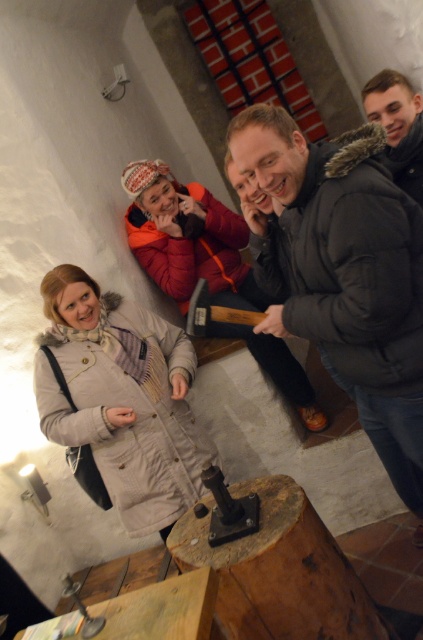
Question: Is the position of black puffy jacket at upper right more distant than that of dark gray fur-lined jacket at upper right?

Choices:
 (A) no
 (B) yes

Answer: (A)

Question: Which point appears farthest from the camera in this image?

Choices:
 (A) (164, 429)
 (B) (211, 333)
 (C) (393, 147)
 (D) (390, 268)

Answer: (B)

Question: Does beige woolen coat at lower left appear on the right side of orange fleece jacket at upper center?

Choices:
 (A) no
 (B) yes

Answer: (A)

Question: Estimate the real-world distances between objects in this image. Which object is farther from the orange fleece jacket at upper center?

Choices:
 (A) black puffy jacket at upper right
 (B) beige woolen coat at lower left

Answer: (A)

Question: Can you confirm if black puffy jacket at upper right is positioned to the right of orange fleece jacket at upper center?

Choices:
 (A) no
 (B) yes

Answer: (B)

Question: Which point is farther from the camera taking this photo?

Choices:
 (A) (420, 156)
 (B) (167, 234)
 (C) (191, 376)
 (D) (310, 276)

Answer: (B)